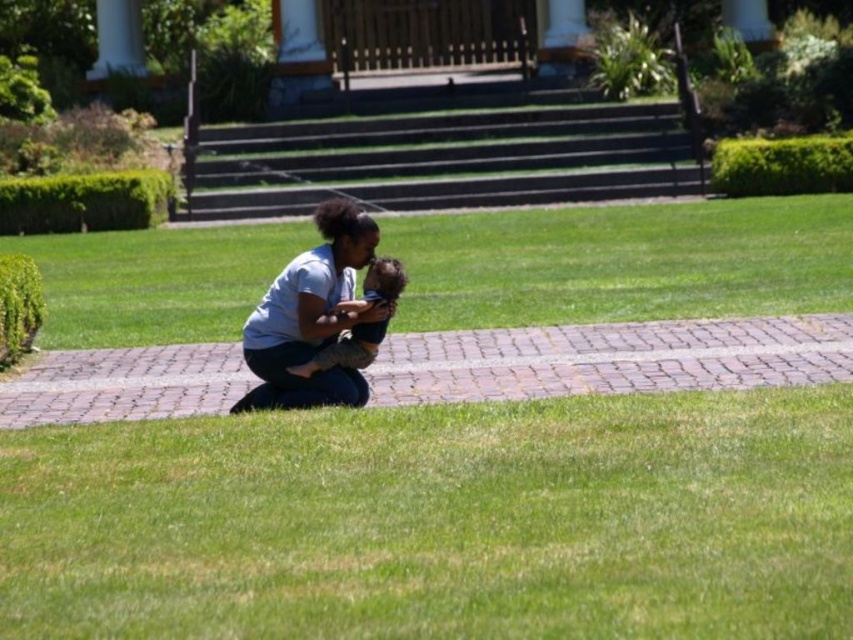
Is green grass at center below smooth skin child at center?

Actually, green grass at center is above smooth skin child at center.

Is green grass at center in front of smooth skin child at center?

No, it is behind smooth skin child at center.

Where is `green grass at center`? green grass at center is located at coordinates [624, 262].

Is green grass at lower center bigger than smooth skin child at center?

Yes.

Between point (466, 484) and point (369, 284), which one is positioned behind?

The point (369, 284) is more distant.

At what (x,y) coordinates should I click in order to perform the action: click on green grass at lower center. Please return your answer as a coordinate pair (x, y). The image size is (853, 640). Looking at the image, I should click on [439, 522].

Is green grass at center taller than light blue cotton shirt at center?

Yes, green grass at center is taller than light blue cotton shirt at center.

Does green grass at center have a lesser width compared to light blue cotton shirt at center?

No.

This screenshot has height=640, width=853. What are the coordinates of `green grass at center` in the screenshot? It's located at (624, 262).